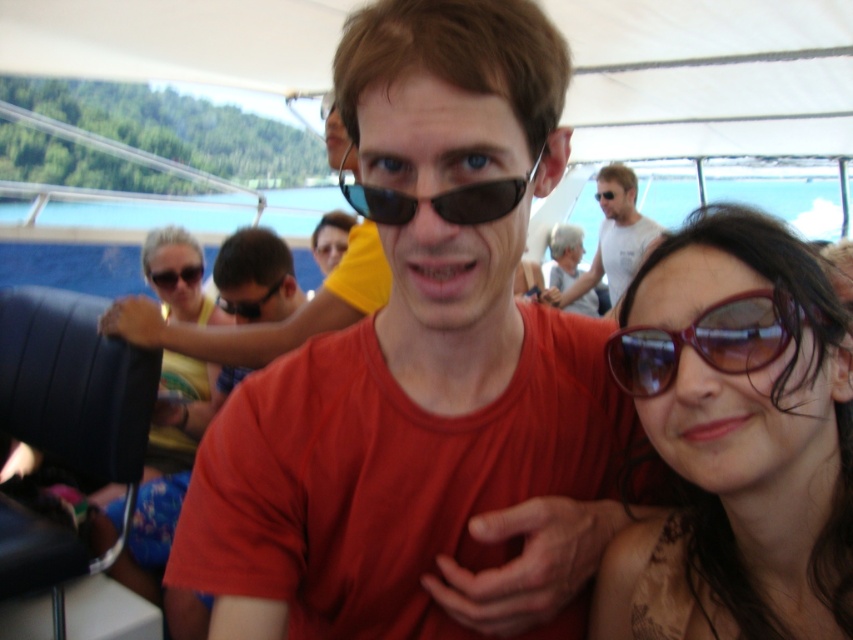
Can you confirm if white matte shirt at upper center is positioned to the right of black plastic goggles at center?

Indeed, white matte shirt at upper center is positioned on the right side of black plastic goggles at center.

Is point (601, 198) in front of point (251, 310)?

That is False.

This screenshot has width=853, height=640. In order to click on white matte shirt at upper center in this screenshot , I will do `click(614, 237)`.

Who is higher up, matte orange t-shirt at center or matte black sunglasses at upper left?

matte black sunglasses at upper left is above.

Who is more distant from viewer, (370,470) or (189,269)?

The point (189,269) is more distant.

Where is `matte orange t-shirt at center`? Image resolution: width=853 pixels, height=640 pixels. matte orange t-shirt at center is located at coordinates (415, 364).

Can you confirm if shiny brown sunglasses at right is positioned to the right of matte yellow sunglasses at upper left?

Yes, shiny brown sunglasses at right is to the right of matte yellow sunglasses at upper left.

Is point (762, 342) positioned before point (198, 280)?

Yes, point (762, 342) is closer to viewer.

At what (x,y) coordinates should I click in order to perform the action: click on shiny brown sunglasses at right. Please return your answer as a coordinate pair (x, y). Looking at the image, I should click on (709, 340).

Locate an element on the screen. shiny brown sunglasses at right is located at coordinates (709, 340).